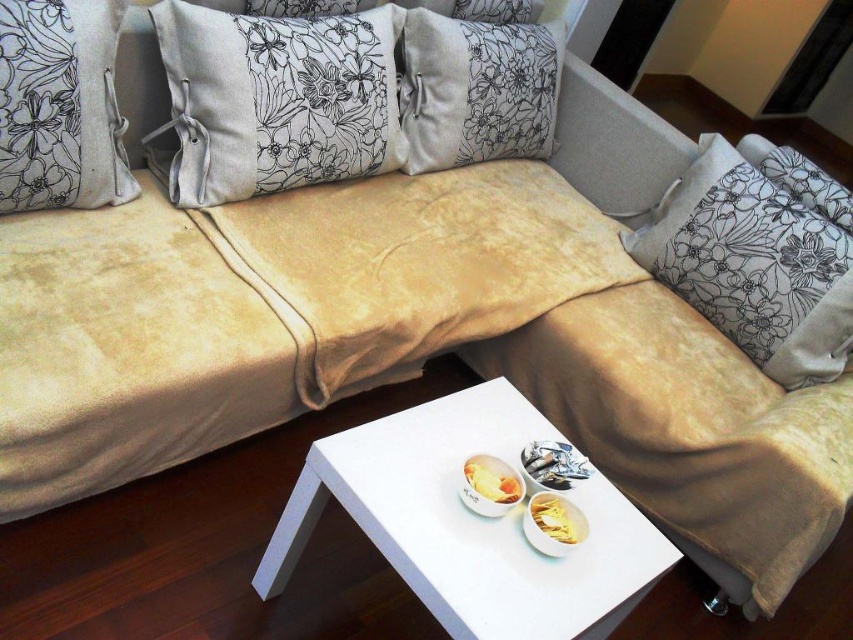
Question: Does white glossy table at center appear on the right side of beige fabric pillow at upper left?

Choices:
 (A) no
 (B) yes

Answer: (B)

Question: Among these objects, which one is nearest to the camera?

Choices:
 (A) yellow matte chips at lower center
 (B) light gray linen pillow at center
 (C) beige fabric pillow at upper left

Answer: (A)

Question: Which of the following is the farthest from the observer?

Choices:
 (A) (367, 54)
 (B) (27, 209)
 (C) (583, 531)

Answer: (A)

Question: Which point is farther from the camera taking this photo?

Choices:
 (A) (669, 192)
 (B) (573, 540)
 (C) (199, 112)
 (D) (39, 8)

Answer: (A)

Question: Is white glossy table at center smaller than beige fabric pillow at upper left?

Choices:
 (A) no
 (B) yes

Answer: (A)

Question: Is floral-patterned fabric pillow at upper right below velvet floral pillow at center?

Choices:
 (A) yes
 (B) no

Answer: (A)